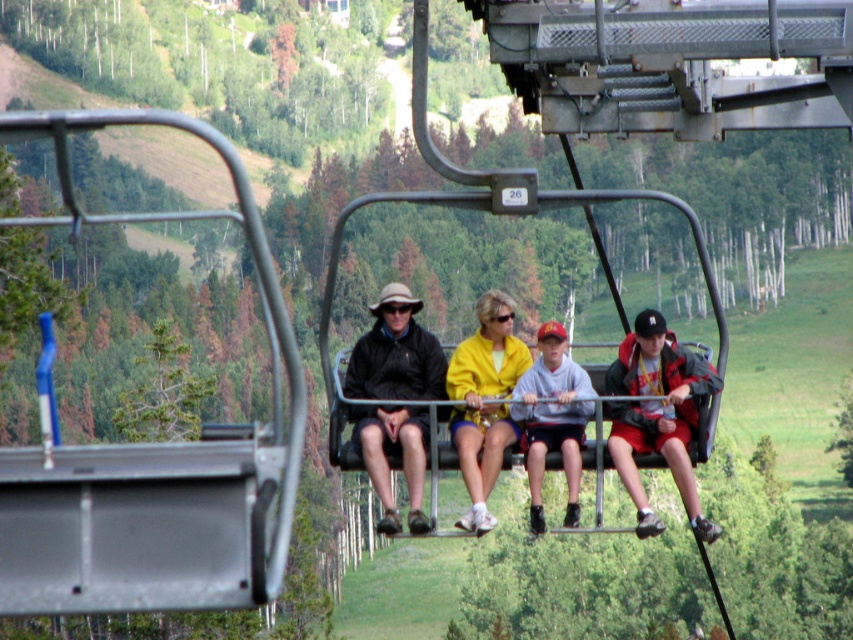
Question: Which point is farther from the camera taking this photo?

Choices:
 (A) (373, 477)
 (B) (682, 496)

Answer: (B)

Question: Can you confirm if red jacket at right is thinner than gray fleece sweatshirt at center?

Choices:
 (A) no
 (B) yes

Answer: (A)

Question: Which object appears closest to the camera in this image?

Choices:
 (A) red jacket at right
 (B) matte black jacket at center
 (C) clear plastic goggles at center

Answer: (A)

Question: Is red jacket at right wider than clear plastic goggles at center?

Choices:
 (A) no
 (B) yes

Answer: (B)

Question: Which of the following is the farthest from the observer?

Choices:
 (A) matte black jacket at center
 (B) clear plastic goggles at center
 (C) yellow matte jacket at center
 (D) red jacket at right

Answer: (B)

Question: Is yellow matte jacket at center smaller than gray fleece sweatshirt at center?

Choices:
 (A) yes
 (B) no

Answer: (A)